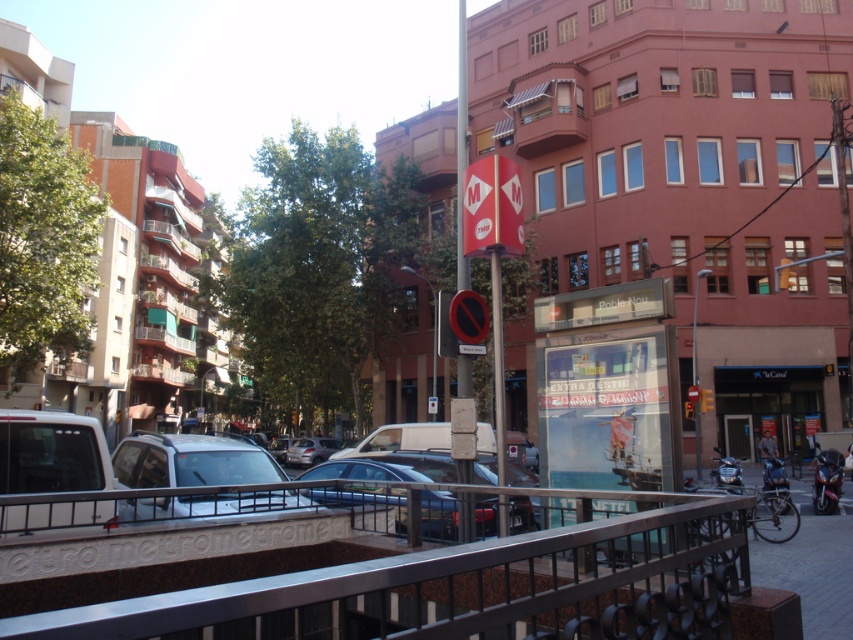
Question: Is polished metal rail at center above red glass traffic light at upper right?

Choices:
 (A) yes
 (B) no

Answer: (B)

Question: Which point is closer to the camera?

Choices:
 (A) (776, 280)
 (B) (699, 502)

Answer: (B)

Question: Which point is farther from the camera taking this photo?

Choices:
 (A) (305, 616)
 (B) (790, 266)

Answer: (B)

Question: Does polished metal rail at center have a smaller size compared to red glass traffic light at upper right?

Choices:
 (A) no
 (B) yes

Answer: (B)

Question: Which point is closer to the camera taking this photo?

Choices:
 (A) (792, 272)
 (B) (500, 604)

Answer: (B)

Question: Does polished metal rail at center have a greater width compared to red glass traffic light at upper right?

Choices:
 (A) no
 (B) yes

Answer: (A)